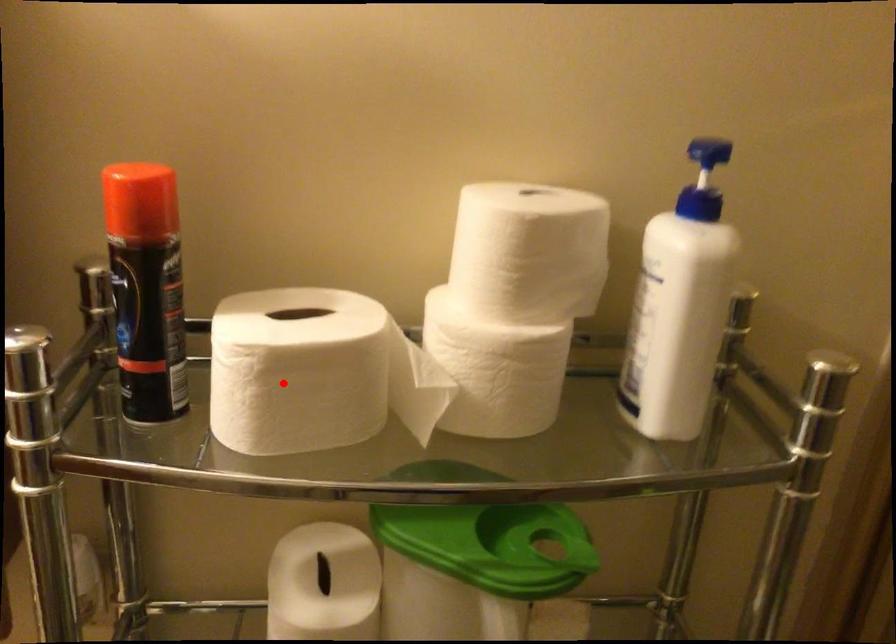
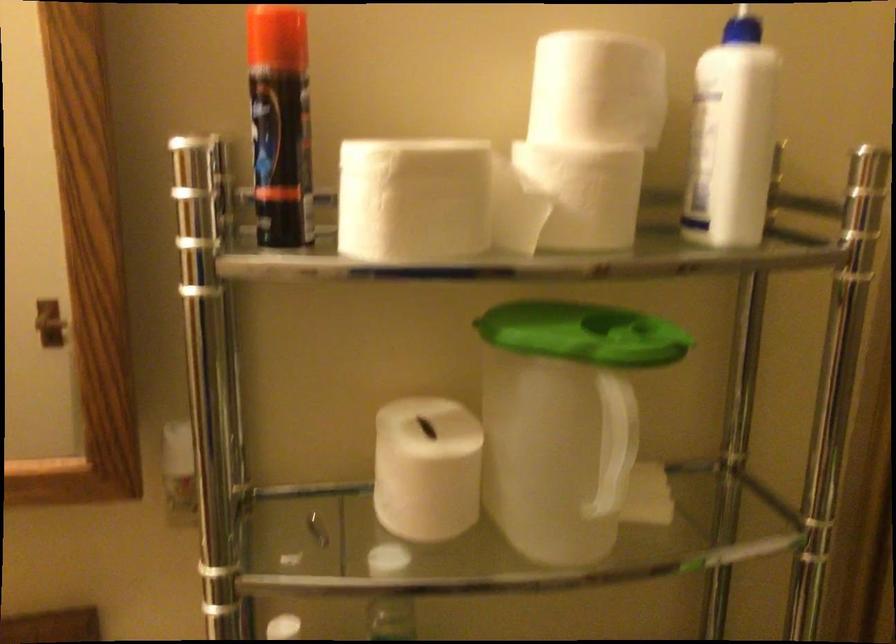
Question: I am providing you with two images of the same scene from different viewpoints. In image1, a red point is highlighted. Considering the same 3D point in image2, which of the following is correct?

Choices:
 (A) It is closer
 (B) It is farther

Answer: (B)